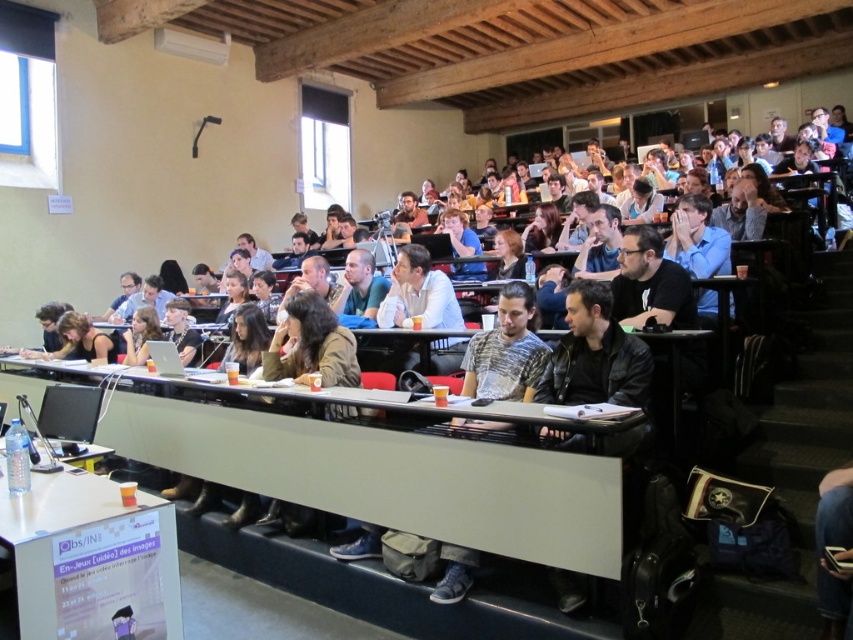
Question: Which point appears closest to the camera in this image?

Choices:
 (A) (85, 589)
 (B) (409, 516)

Answer: (A)

Question: Can you confirm if white plastic table at lower center is positioned above white plastic table at lower left?

Choices:
 (A) no
 (B) yes

Answer: (B)

Question: From the image, what is the correct spatial relationship of white plastic table at lower center in relation to white plastic table at lower left?

Choices:
 (A) left
 (B) right

Answer: (B)

Question: Is white plastic table at lower center bigger than white plastic table at lower left?

Choices:
 (A) no
 (B) yes

Answer: (B)